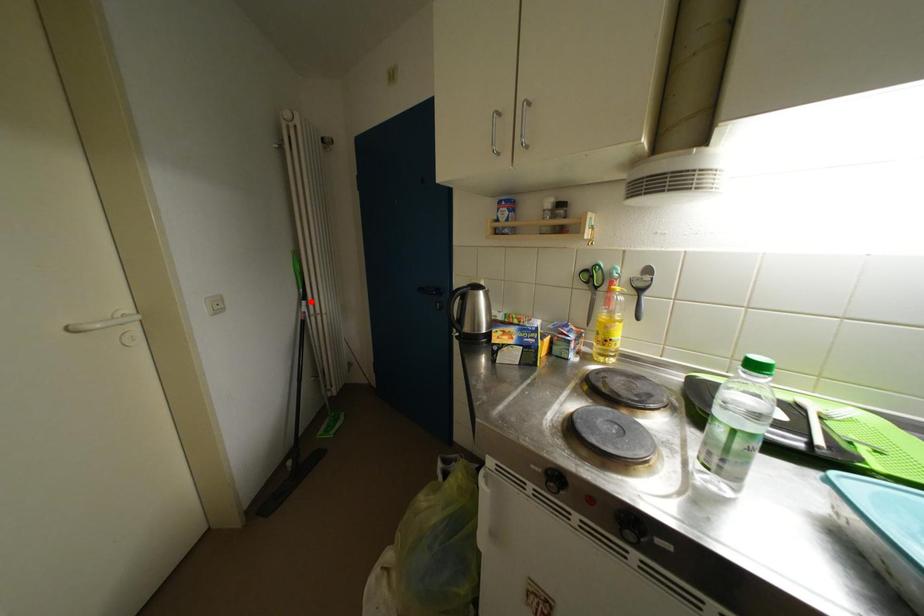
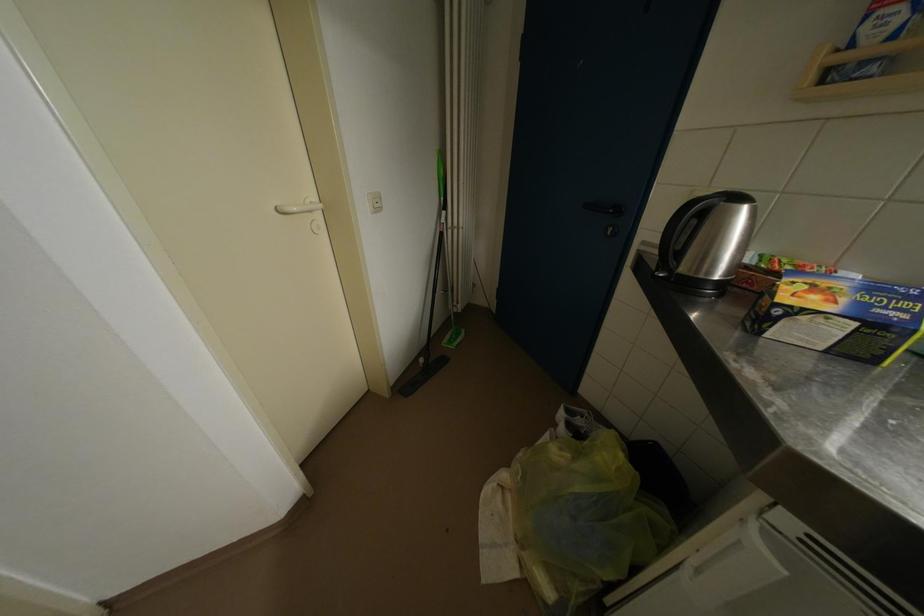
Question: I am providing you with two images of the same scene from different viewpoints. Given a red point in image1, look at the same physical point in image2. Is it:

Choices:
 (A) Closer to the viewpoint
 (B) Farther from the viewpoint

Answer: (A)